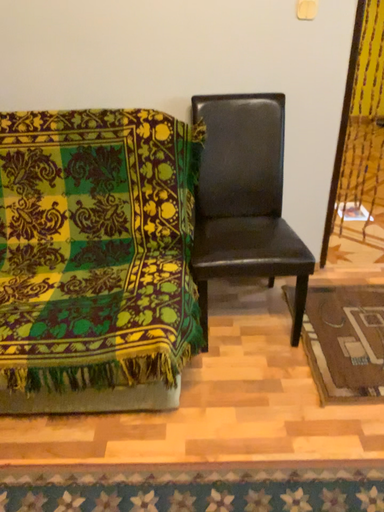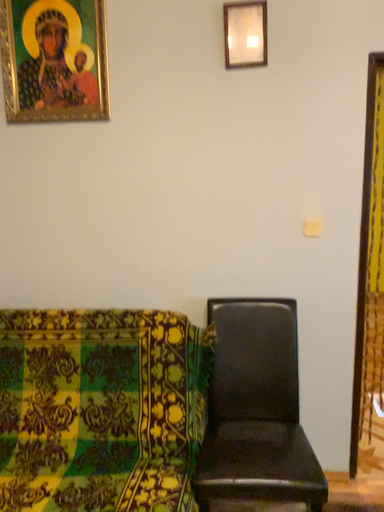
Question: Which way did the camera rotate in the video?

Choices:
 (A) rotated upward
 (B) rotated downward

Answer: (A)